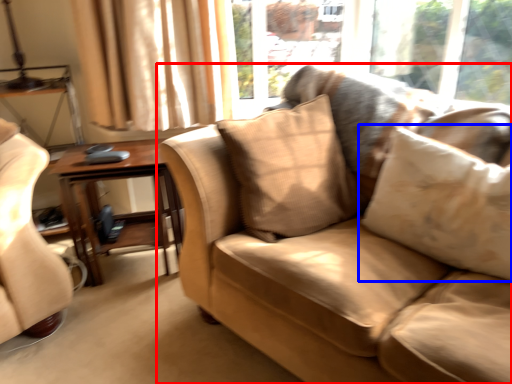
Question: Which object appears farthest to the camera in this image, studio couch (highlighted by a red box) or pillow (highlighted by a blue box)?

Choices:
 (A) studio couch
 (B) pillow

Answer: (B)